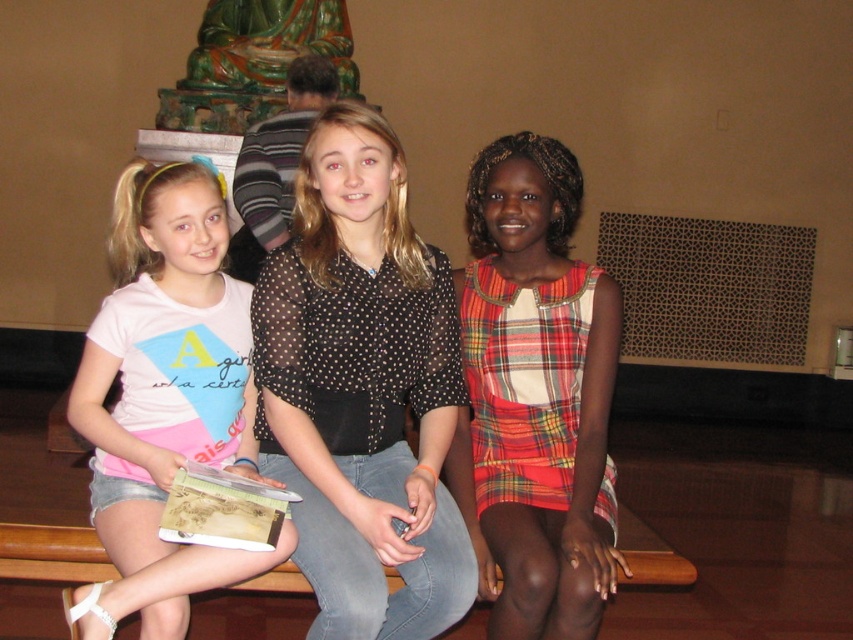
Question: Considering the relative positions of plaid fabric dress at right and pink cotton t-shirt at left in the image provided, where is plaid fabric dress at right located with respect to pink cotton t-shirt at left?

Choices:
 (A) above
 (B) below

Answer: (B)

Question: Does black sheer blouse at center appear on the right side of pink cotton t-shirt at left?

Choices:
 (A) no
 (B) yes

Answer: (B)

Question: Which object is positioned closest to the pink cotton t-shirt at left?

Choices:
 (A) plaid fabric dress at right
 (B) black sheer blouse at center

Answer: (B)

Question: Does black sheer blouse at center appear on the right side of pink cotton t-shirt at left?

Choices:
 (A) no
 (B) yes

Answer: (B)

Question: Which object is closer to the camera taking this photo?

Choices:
 (A) plaid fabric dress at right
 (B) pink cotton t-shirt at left
 (C) black sheer blouse at center

Answer: (B)

Question: Among these points, which one is farthest from the camera?

Choices:
 (A) (166, 184)
 (B) (606, 380)
 (C) (349, 172)

Answer: (C)